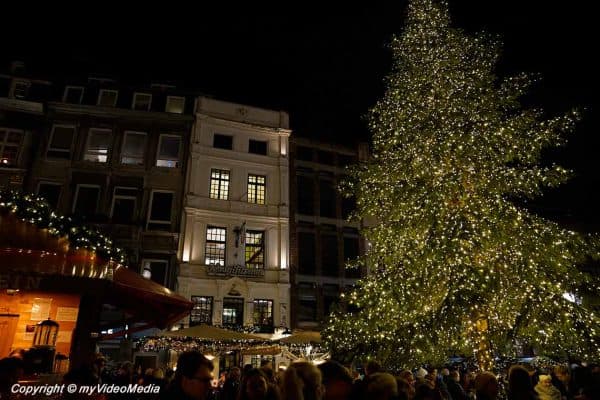
This screenshot has height=400, width=600. Identify the location of door. (5, 332).